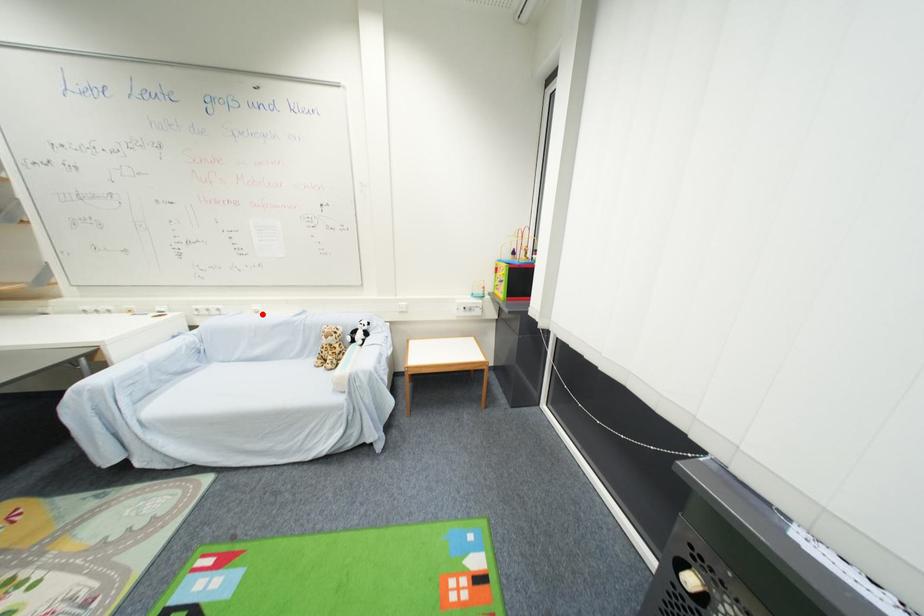
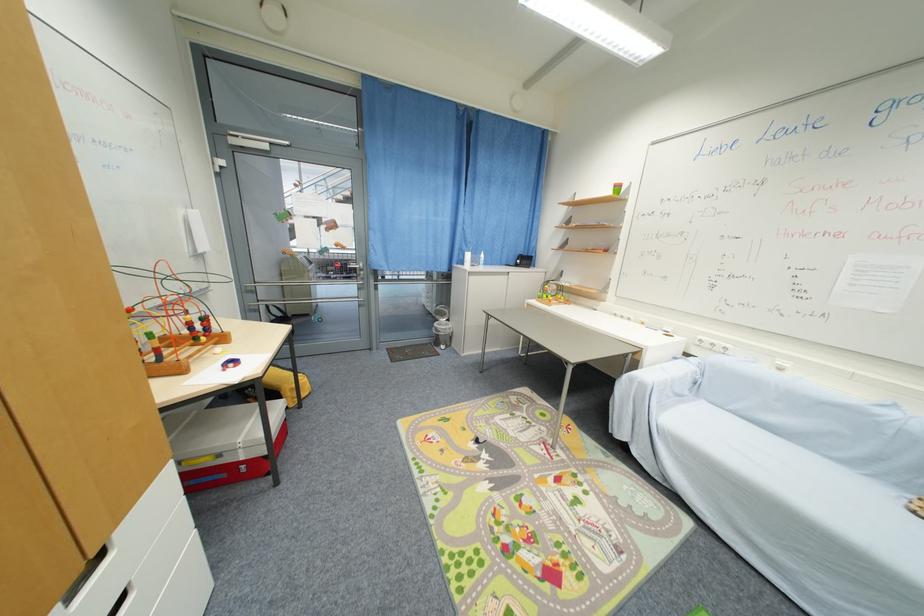
The point at the highlighted location is marked in the first image. Where is the corresponding point in the second image?

(785, 371)